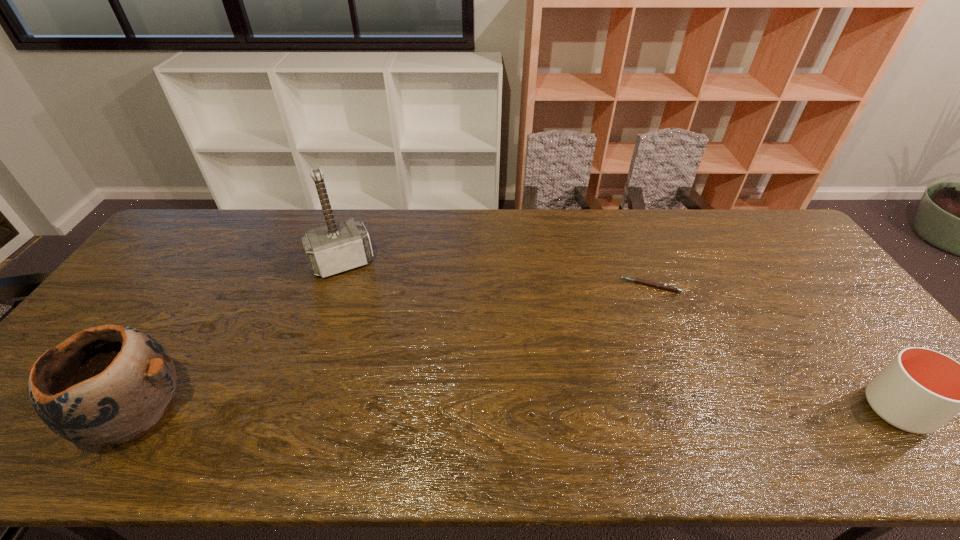
Find the location of `vacant space that satisfies the following two spatial constraints: 1. on the front side of the cup; 2. on the left side of the shortest object`. vacant space that satisfies the following two spatial constraints: 1. on the front side of the cup; 2. on the left side of the shortest object is located at coordinates (699, 409).

Image resolution: width=960 pixels, height=540 pixels. I want to click on free point that satisfies the following two spatial constraints: 1. on the front side of the cup; 2. on the right side of the shortest object, so click(699, 409).

At what (x,y) coordinates should I click in order to perform the action: click on free space that satisfies the following two spatial constraints: 1. on the front side of the third tallest object; 2. on the right side of the shortest object. Please return your answer as a coordinate pair (x, y). The width and height of the screenshot is (960, 540). Looking at the image, I should click on (699, 409).